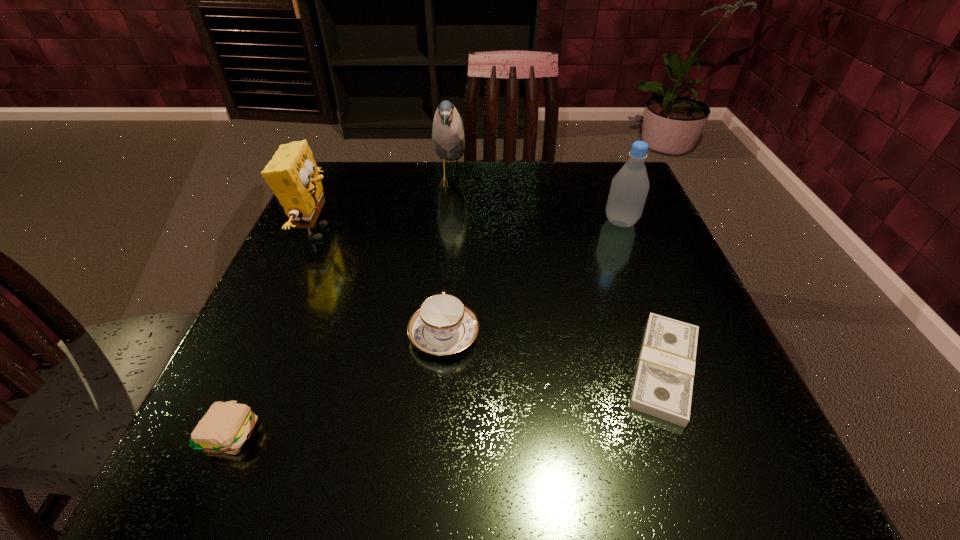
I want to click on free location located 0.160m on the side with the handle of the teacup, so click(x=450, y=251).

The height and width of the screenshot is (540, 960). I want to click on vacant area located 0.210m on the side with the handle of the teacup, so click(x=451, y=236).

You are a GUI agent. You are given a task and a screenshot of the screen. Output one action in this format:
    pyautogui.click(x=<x>, y=<y>)
    Task: Click on the free location located 0.170m on the back of the second shortest object
    This screenshot has width=960, height=540.
    Given the screenshot: What is the action you would take?
    pyautogui.click(x=280, y=320)

The image size is (960, 540). Find the location of `free location located 0.070m on the left of the shortest object`. free location located 0.070m on the left of the shortest object is located at coordinates (573, 369).

Where is `bird located in the far edge section of the desktop`? This screenshot has width=960, height=540. bird located in the far edge section of the desktop is located at coordinates (x=448, y=138).

Image resolution: width=960 pixels, height=540 pixels. Find the location of `bottle that is positioned at the far edge`. bottle that is positioned at the far edge is located at coordinates (629, 188).

Where is `sponge located at the far edge`? The width and height of the screenshot is (960, 540). sponge located at the far edge is located at coordinates (292, 174).

Locate an element on the screen. This screenshot has height=540, width=960. object that is at the near edge is located at coordinates (226, 426).

The image size is (960, 540). In order to click on sponge that is positioned at the left edge in this screenshot , I will do (292, 174).

Locate an element on the screen. patty that is at the left edge is located at coordinates (226, 426).